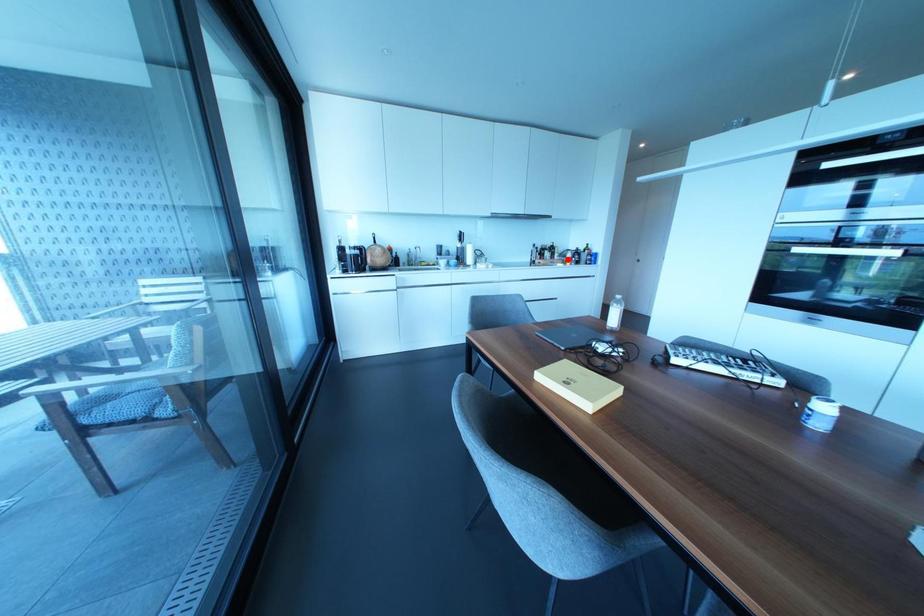
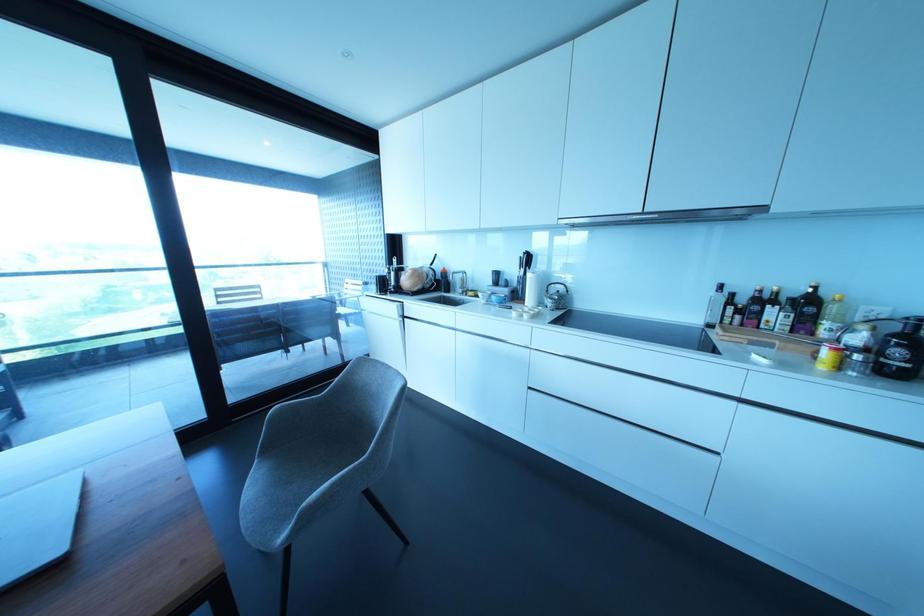
Find the pixel in the second image that matches the highlighted location in the first image.

(825, 353)